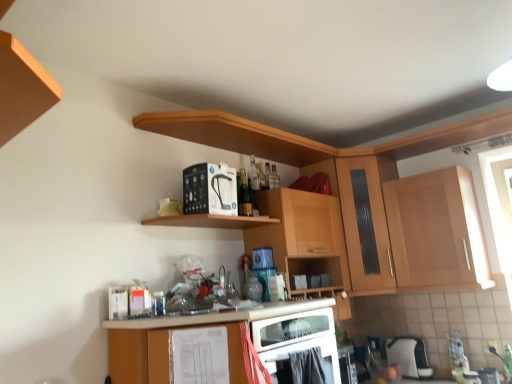
I want to click on vacant region under black plastic water filter at upper center, acting as the first appliance starting from the front (from a real-world perspective), so click(x=217, y=216).